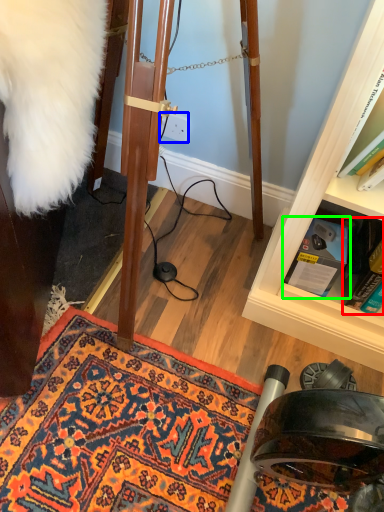
Question: Considering the real-world distances, which object is farthest from book (highlighted by a red box)? power outlet (highlighted by a blue box) or book (highlighted by a green box)?

Choices:
 (A) power outlet
 (B) book

Answer: (A)